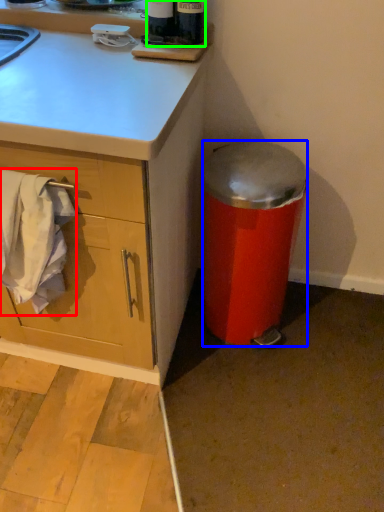
Question: Considering the real-world distances, which object is farthest from laundry (highlighted by a red box)? trash bin/can (highlighted by a blue box) or bottle (highlighted by a green box)?

Choices:
 (A) trash bin/can
 (B) bottle

Answer: (B)